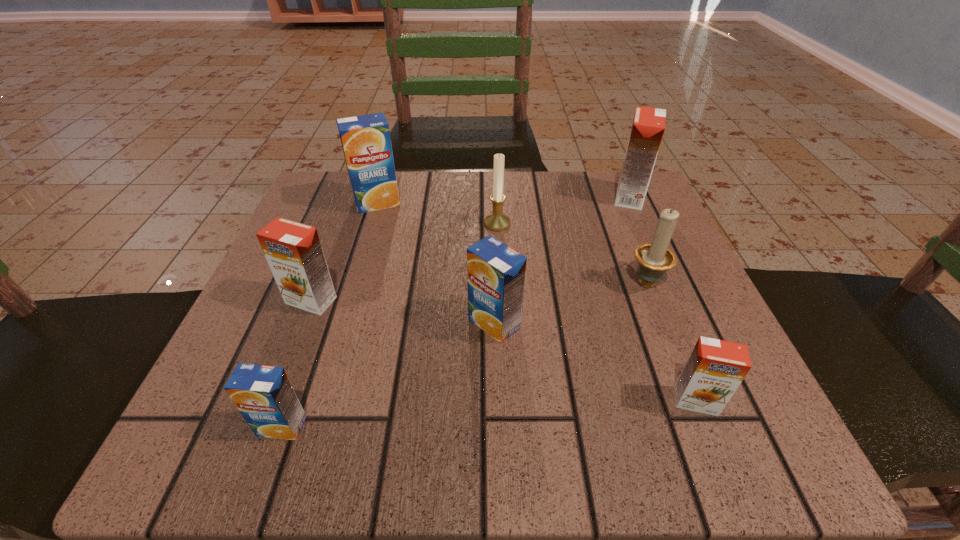
You are a GUI agent. You are given a task and a screenshot of the screen. Output one action in this format:
    pyautogui.click(x=<x>, y=<y>)
    Task: Click on the farthest blue orange_juice
    
    Given the screenshot: What is the action you would take?
    pyautogui.click(x=366, y=142)

Where is `the farthest orange orange juice`? The width and height of the screenshot is (960, 540). the farthest orange orange juice is located at coordinates (648, 127).

Where is `the farther candle_holder`? the farther candle_holder is located at coordinates (497, 221).

Locate an element on the screen. The width and height of the screenshot is (960, 540). the third farthest object is located at coordinates (497, 221).

You are a GUI agent. You are given a task and a screenshot of the screen. Output one action in this format:
    pyautogui.click(x=<x>, y=<y>)
    Task: Click on the nearer candle_holder
    The width and height of the screenshot is (960, 540).
    Given the screenshot: What is the action you would take?
    pyautogui.click(x=654, y=258)

The height and width of the screenshot is (540, 960). Find the location of `the second biggest orange orange juice`. the second biggest orange orange juice is located at coordinates (293, 251).

Image resolution: width=960 pixels, height=540 pixels. Find the location of `the second farthest orange orange juice`. the second farthest orange orange juice is located at coordinates (293, 251).

This screenshot has height=540, width=960. In order to click on the second nearest blue orange_juice in this screenshot , I will do `click(496, 273)`.

At what (x,y) coordinates should I click in order to perform the action: click on the third orange_juice from right to left. Please return your answer as a coordinate pair (x, y). This screenshot has height=540, width=960. Looking at the image, I should click on (496, 273).

You are a GUI agent. You are given a task and a screenshot of the screen. Output one action in this format:
    pyautogui.click(x=<x>, y=<y>)
    Task: Click on the nearest orange orange juice
    The height and width of the screenshot is (540, 960).
    Given the screenshot: What is the action you would take?
    pyautogui.click(x=715, y=369)